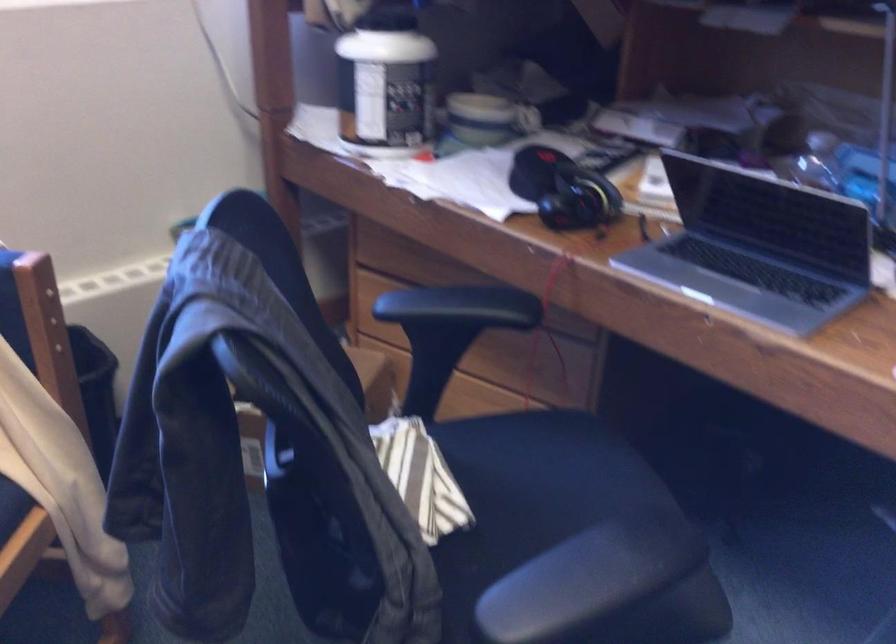
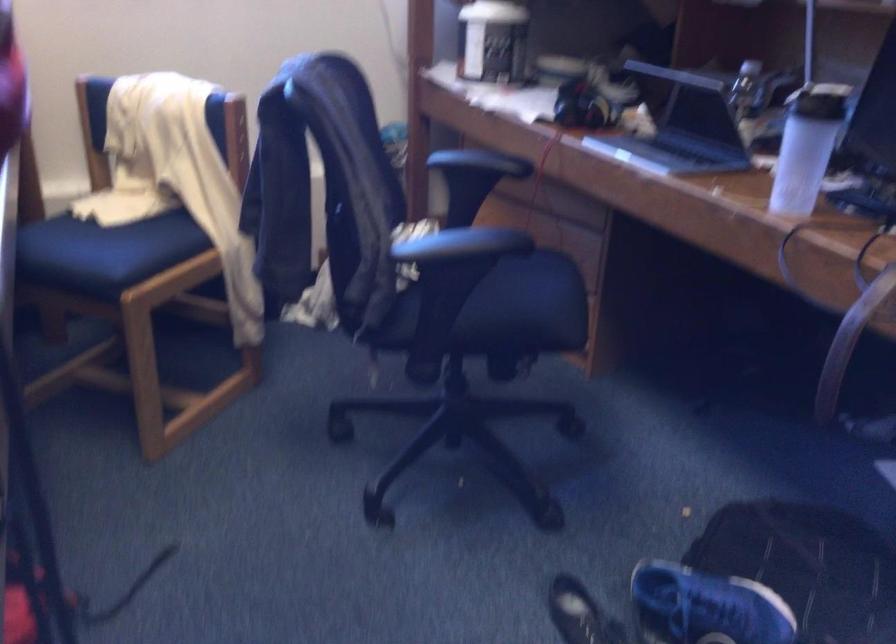
Where in the second image is the point corresponding to [618,567] from the first image?

(471, 242)